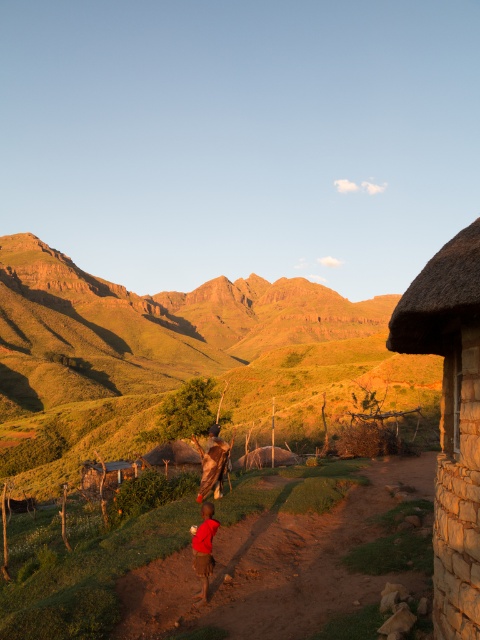
You are a hiker who wants to reach the thatched straw hut at right from the brown dirt path at lower center. Which direction should you walk relative to the path?

You should walk to the right from the brown dirt path at lower center because the thatched straw hut at right is located to the right of the path.

You are standing at the center of the dirt path in the foreground and want to reach the green grassy mountain at upper left. Which direction should you head towards?

The green grassy mountain at upper left is located at point (180, 358), so you should head towards the upper left direction to reach it.

You are standing at the dirt path in the foreground and want to reach the thatched straw hut at right. Which direction should you walk relative to the green grassy mountain at upper left?

You should walk to the right of the green grassy mountain at upper left because the thatched straw hut at right is located to the right of it.